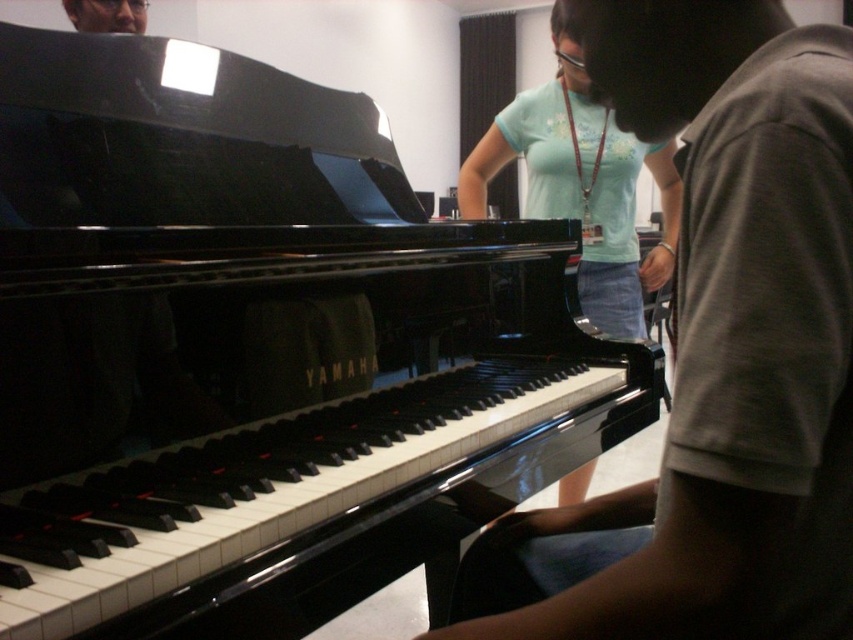
Describe the element at coordinates (730, 339) in the screenshot. I see `matte black piano at left` at that location.

Is point (631, 22) less distant than point (598, 113)?

Yes.

This screenshot has height=640, width=853. What do you see at coordinates (730, 339) in the screenshot?
I see `matte black piano at left` at bounding box center [730, 339].

Find the location of `matte black piano at left`. matte black piano at left is located at coordinates (730, 339).